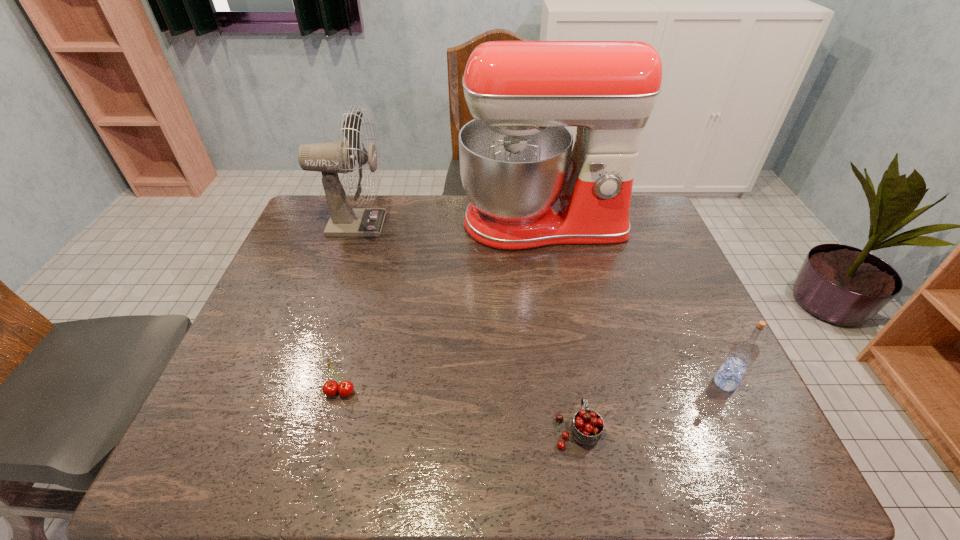
What are the coordinates of `vacant area situated 0.380m on the handle side of the nearer cherry` in the screenshot? It's located at (552, 285).

Locate an element on the screen. The height and width of the screenshot is (540, 960). vacant space located on the handle side of the nearer cherry is located at coordinates (564, 360).

I want to click on vacant area located on the handle side of the nearer cherry, so click(x=558, y=318).

Find the location of a particular element. Image resolution: width=960 pixels, height=540 pixels. free space located with the stems of the left cherry pointing upwards is located at coordinates (331, 426).

You are a GUI agent. You are given a task and a screenshot of the screen. Output one action in this format:
    pyautogui.click(x=<x>, y=<y>)
    Task: Click on the mixer located in the far edge section of the desktop
    The height and width of the screenshot is (540, 960).
    Given the screenshot: What is the action you would take?
    pyautogui.click(x=528, y=188)

Where is `fan present at the far edge`? fan present at the far edge is located at coordinates (331, 158).

Identify the location of object at the near edge. [587, 426].

This screenshot has height=540, width=960. In order to click on object situated at the left edge in this screenshot , I will do (331, 158).

You are a GUI agent. You are given a task and a screenshot of the screen. Output one action in this format:
    pyautogui.click(x=<x>, y=<y>)
    Task: Click on the mixer that is at the right edge
    
    Given the screenshot: What is the action you would take?
    pyautogui.click(x=528, y=188)

Where is `vodka that is at the right edge`? The height and width of the screenshot is (540, 960). vodka that is at the right edge is located at coordinates (743, 353).